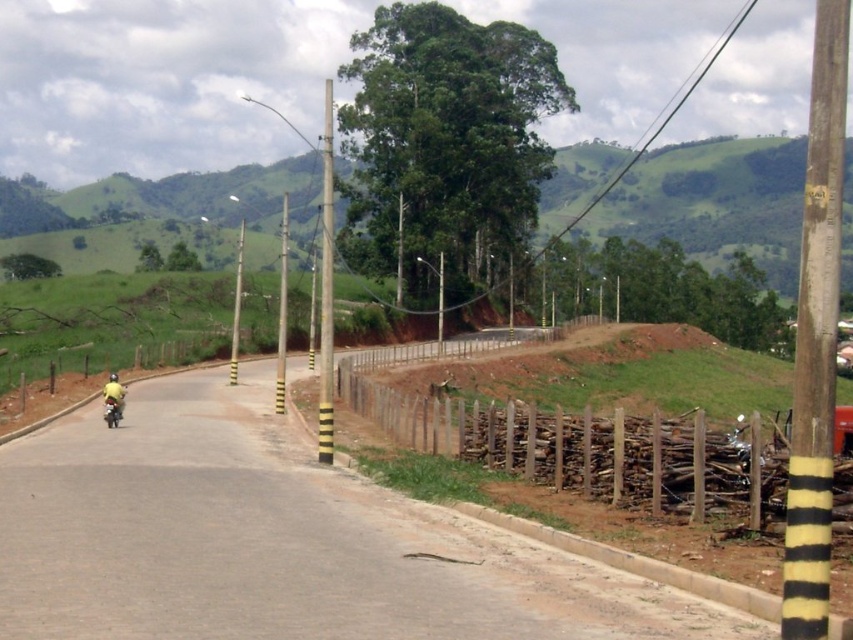
You are standing at the side of the road and want to take a photo of both the green grassy hill at upper center and the yellow fabric person at left. Which object should you focus on first to ensure both are in sharp focus?

You should focus on the green grassy hill at upper center first because it is closer to the viewer than the yellow fabric person at left, so adjusting focus from near to far will help both be in focus.

You are standing at the point labeled as point (277, 541) in the rural road scene. You want to walk to the wooden fence on the right side of the road. Which direction should you face to walk directly toward the wooden fence on the right side of the road?

You should face toward the right side of the road to walk directly toward the wooden fence on the right side of the road since the point (277, 541) is located on the brown dirt track at lower right, which is near the fence.

You are standing at the starting point of the road and want to reach the brown dirt track at lower right. Which direction should you head towards?

The brown dirt track at lower right is located at coordinates point (277, 541), so you should head towards the lower right direction to reach it.